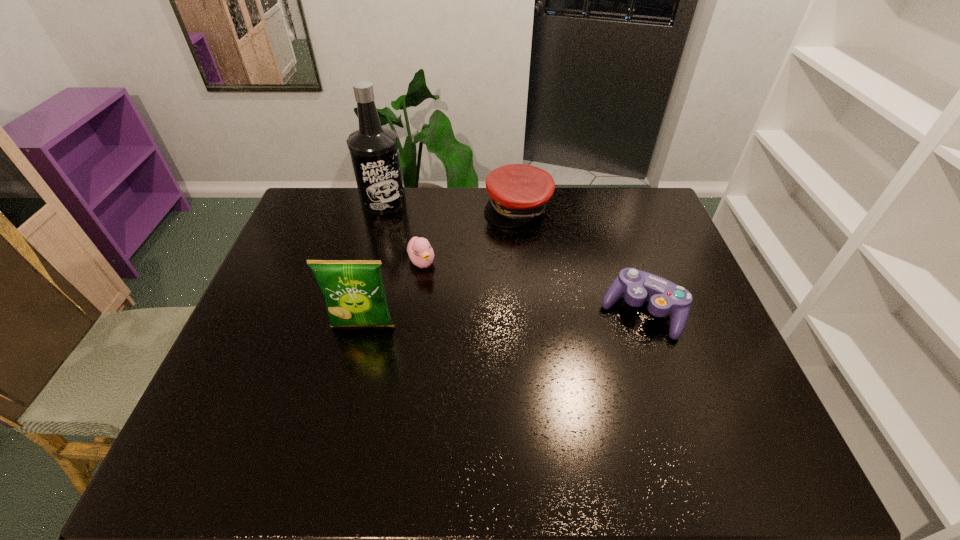
Find the location of `free space located on the front-facing side of the cap`. free space located on the front-facing side of the cap is located at coordinates 535,280.

This screenshot has width=960, height=540. Find the location of `free location located on the front label of the liquor`. free location located on the front label of the liquor is located at coordinates (399, 224).

Locate an element on the screen. The height and width of the screenshot is (540, 960). free region located on the front label of the liquor is located at coordinates (434, 269).

I want to click on vacant area located 0.090m on the front label of the liquor, so click(x=403, y=228).

At what (x,y) coordinates should I click in order to perform the action: click on vacant position located 0.250m on the front-facing side of the third object from left to right. Please return your answer as a coordinate pair (x, y). This screenshot has width=960, height=540. Looking at the image, I should click on (468, 332).

At what (x,y) coordinates should I click in order to perform the action: click on free space located 0.050m on the front-facing side of the third object from left to right. Please return your answer as a coordinate pair (x, y). Looking at the image, I should click on (434, 285).

I want to click on vacant area situated on the front-facing side of the third object from left to right, so [x=468, y=334].

You are a GUI agent. You are given a task and a screenshot of the screen. Output one action in this format:
    pyautogui.click(x=<x>, y=<y>)
    Task: Click on the cap that is at the far edge
    Image resolution: width=960 pixels, height=540 pixels.
    Given the screenshot: What is the action you would take?
    pyautogui.click(x=518, y=193)

Identify the location of liquor present at the far edge. (374, 150).

Locate an element on the screen. object present at the right edge is located at coordinates (663, 296).